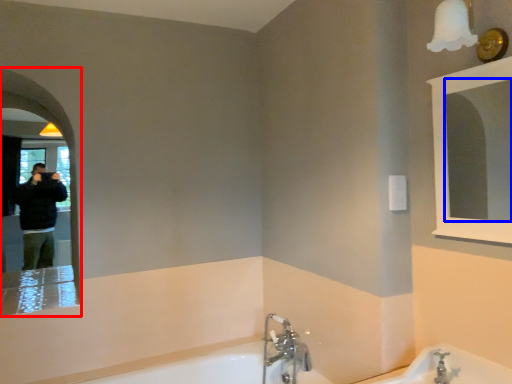
Question: Which object appears farthest to the camera in this image, mirror (highlighted by a red box) or mirror (highlighted by a blue box)?

Choices:
 (A) mirror
 (B) mirror

Answer: (A)